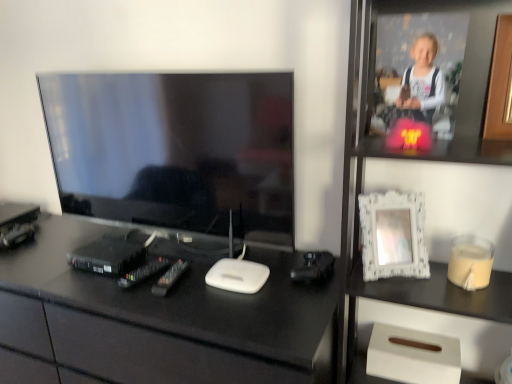
Question: Does white textured frame at upper right have a greater height compared to matte black tv at left?

Choices:
 (A) no
 (B) yes

Answer: (B)

Question: Is white textured frame at upper right facing away from matte black tv at left?

Choices:
 (A) yes
 (B) no

Answer: (B)

Question: From the image's perspective, is white textured frame at upper right over matte black tv at left?

Choices:
 (A) yes
 (B) no

Answer: (B)

Question: From a real-world perspective, is white textured frame at upper right located beneath matte black tv at left?

Choices:
 (A) yes
 (B) no

Answer: (A)

Question: Is white textured frame at upper right touching matte black tv at left?

Choices:
 (A) no
 (B) yes

Answer: (A)

Question: Is black glossy desk at center spatially inside matte black tv at left, or outside of it?

Choices:
 (A) inside
 (B) outside

Answer: (B)

Question: Considering the positions of black glossy desk at center and matte black tv at left in the image, is black glossy desk at center bigger or smaller than matte black tv at left?

Choices:
 (A) small
 (B) big

Answer: (B)

Question: Does point (283, 372) appear closer or farther from the camera than point (237, 125)?

Choices:
 (A) closer
 (B) farther

Answer: (A)

Question: Is black glossy desk at center to the left or to the right of matte black tv at left in the image?

Choices:
 (A) left
 (B) right

Answer: (A)

Question: Considering their positions, is beige matte candle at right located in front of or behind black glossy desk at center?

Choices:
 (A) front
 (B) behind

Answer: (B)

Question: From the image's perspective, relative to black glossy desk at center, is beige matte candle at right above or below?

Choices:
 (A) below
 (B) above

Answer: (B)

Question: Is beige matte candle at right bigger or smaller than black glossy desk at center?

Choices:
 (A) big
 (B) small

Answer: (B)

Question: Considering the positions of beige matte candle at right and black glossy desk at center in the image, is beige matte candle at right wider or thinner than black glossy desk at center?

Choices:
 (A) thin
 (B) wide

Answer: (A)

Question: Relative to wooden at upper right, the first picture frame viewed from the right, is beige matte candle at right in front or behind?

Choices:
 (A) front
 (B) behind

Answer: (B)

Question: From the image's perspective, is beige matte candle at right above or below wooden at upper right, the second picture frame positioned from the left?

Choices:
 (A) above
 (B) below

Answer: (B)